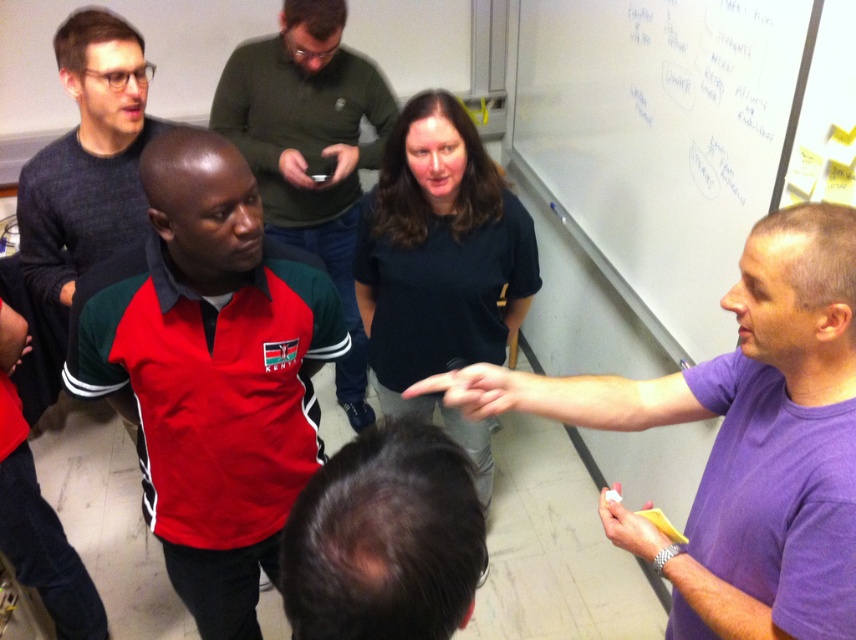
You are standing at the point labeled point [438,428] and want to walk to the point labeled point [155,481]. Is there a direct path between these two points without needing to go around any obstacles?

Point [155,481] is behind point [438,428], so there is no direct path between them. You would need to go around the obstacle in front of point [438,428] to reach point [155,481].

You are standing in the room and want to hand a document to the person wearing the red polyester shirt at center. Based on their position, which direction should you move to reach them?

The red polyester shirt at center is located at point 0.581 on the x and 0.246 on the y axis, so you should move towards the center of the room to reach them.

Looking at the scene, which object is bigger between the red polyester shirt at center and the dark brown hair at center?

The red polyester shirt at center is larger in size than the dark brown hair at center.